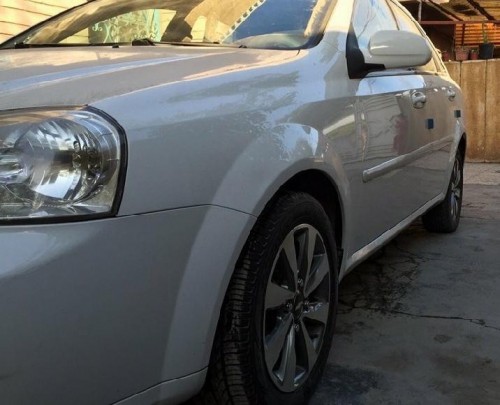
This screenshot has width=500, height=405. In order to click on mirror in this screenshot , I will do click(394, 43).